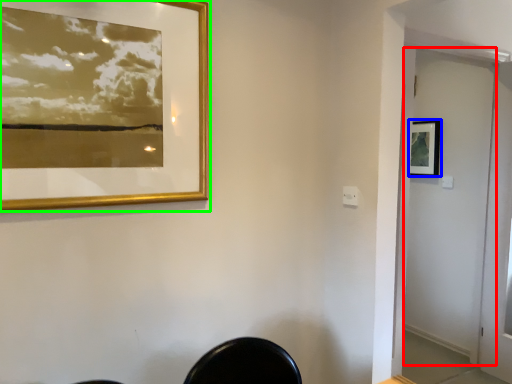
Question: Based on their relative distances, which object is farther from screen door (highlighted by a red box)? Choose from picture frame (highlighted by a blue box) and picture frame (highlighted by a green box).

Choices:
 (A) picture frame
 (B) picture frame

Answer: (B)